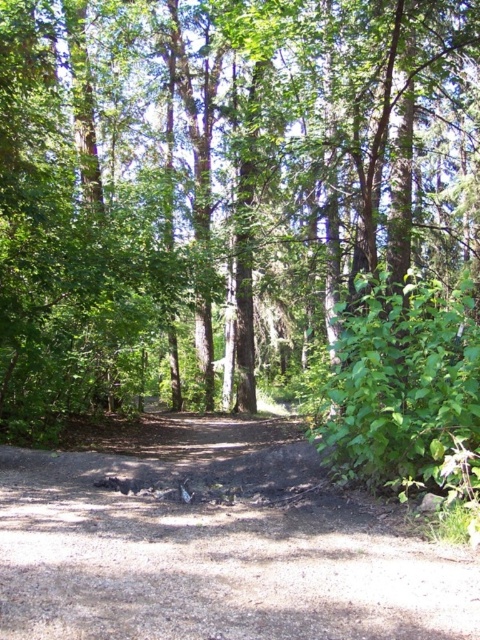
Question: Does green leafy tree at center appear on the left side of brown dirt track at center?

Choices:
 (A) no
 (B) yes

Answer: (A)

Question: Among these points, which one is nearest to the camera?

Choices:
 (A) (113, 360)
 (B) (369, 552)

Answer: (B)

Question: Is green leafy tree at center to the right of brown dirt track at center from the viewer's perspective?

Choices:
 (A) yes
 (B) no

Answer: (A)

Question: Is green leafy tree at center to the left of brown dirt track at center from the viewer's perspective?

Choices:
 (A) yes
 (B) no

Answer: (B)